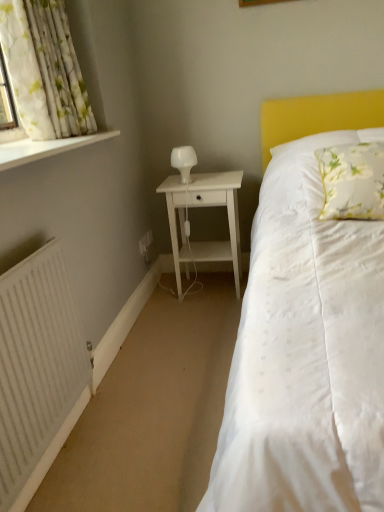
Identify the location of free point to the right of white matte radiator at lower left. (144, 437).